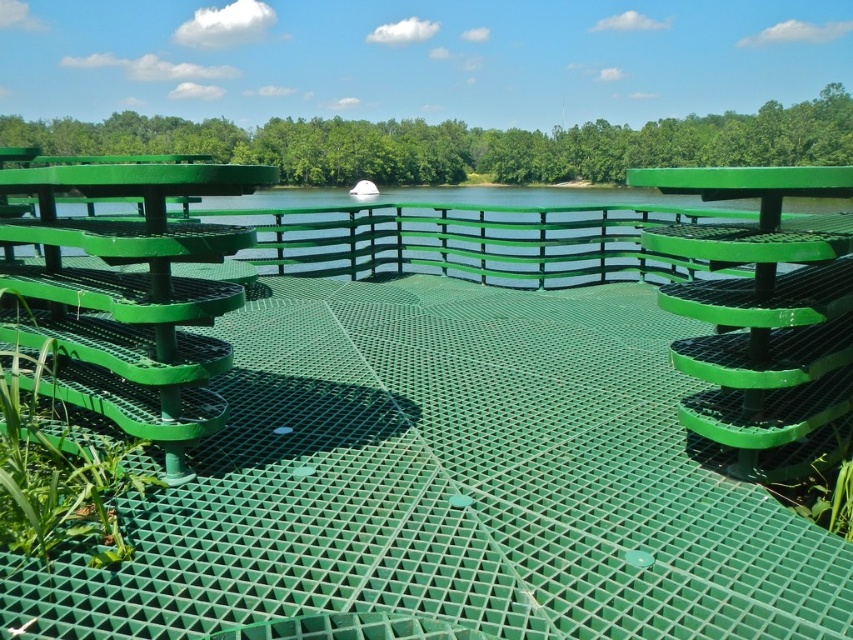
Does green plastic bench at upper left appear on the right side of green matte bench at center?

Incorrect, green plastic bench at upper left is not on the right side of green matte bench at center.

Which is more to the left, green plastic bench at upper left or green matte bench at center?

From the viewer's perspective, green plastic bench at upper left appears more on the left side.

Between point (131, 257) and point (820, 326), which one is positioned in front?

Point (131, 257) is in front.

Find the location of a particular element. The image size is (853, 640). green plastic bench at upper left is located at coordinates (131, 296).

Can you confirm if green matte bench at center is thinner than green mesh water at center?

Yes, green matte bench at center is thinner than green mesh water at center.

In the scene shown: Who is positioned more to the right, green matte bench at center or green mesh water at center?

green mesh water at center

Between point (825, 216) and point (265, 237), which one is positioned in front?

Point (825, 216) is in front.

Find the location of `green matte bench at center`. green matte bench at center is located at coordinates (763, 317).

Who is higher up, green plastic bench at upper left or green mesh water at center?

green mesh water at center is above.

Does point (83, 186) lie in front of point (254, 209)?

Yes, point (83, 186) is closer to viewer.

Locate an element on the screen. This screenshot has width=853, height=640. green plastic bench at upper left is located at coordinates (131, 296).